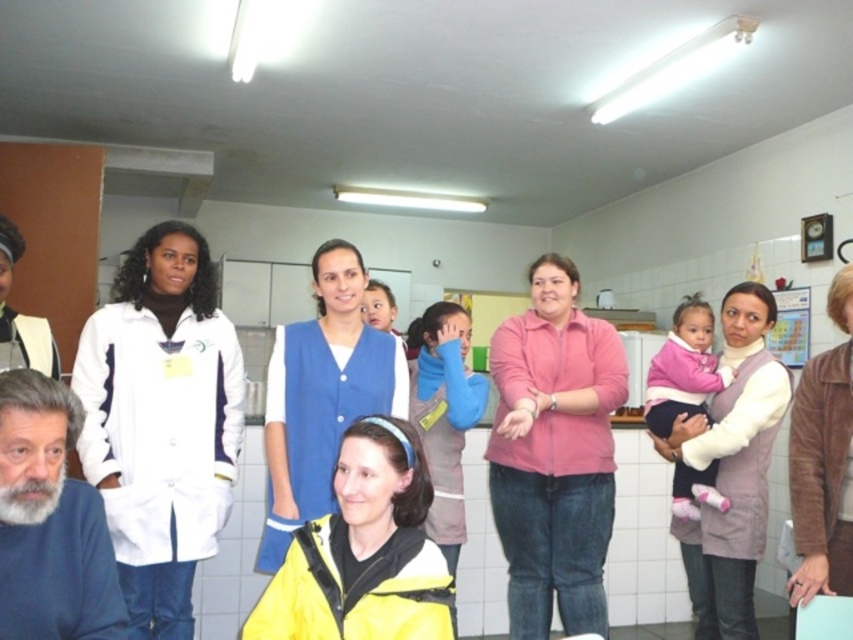
Question: Which point is farther from the camera taking this photo?

Choices:
 (A) (120, 288)
 (B) (764, 451)

Answer: (B)

Question: Does white lab coat at center appear under white matte lab coat at left?

Choices:
 (A) no
 (B) yes

Answer: (B)

Question: Which object is positioned farthest from the white matte lab coat at left?

Choices:
 (A) yellow matte jacket at lower center
 (B) blue fabric vest at center

Answer: (A)

Question: Can you confirm if pink matte shirt at center is bigger than blue fabric vest at center?

Choices:
 (A) yes
 (B) no

Answer: (A)

Question: Which is nearer to the pink fleece jacket at center?

Choices:
 (A) blue fabric vest at center
 (B) light brown textured vest at center
 (C) yellow matte jacket at lower center

Answer: (B)

Question: Is white matte lab coat at left behind light brown textured vest at center?

Choices:
 (A) yes
 (B) no

Answer: (B)